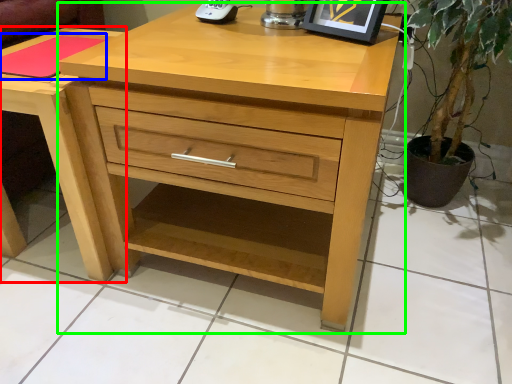
Question: Which object is the closest to the nightstand (highlighted by a red box)? Choose among these: pad (highlighted by a blue box) or chest of drawers (highlighted by a green box).

Choices:
 (A) pad
 (B) chest of drawers

Answer: (A)